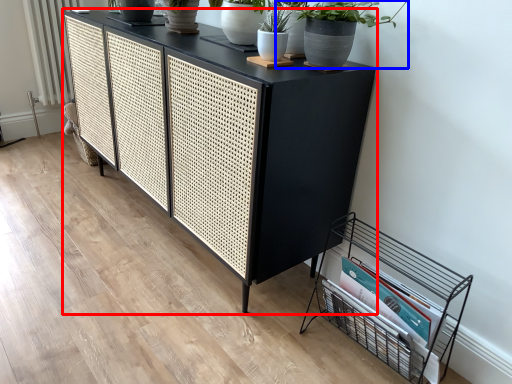
Question: Which object appears farthest to the camera in this image, table (highlighted by a red box) or houseplant (highlighted by a blue box)?

Choices:
 (A) table
 (B) houseplant

Answer: (A)